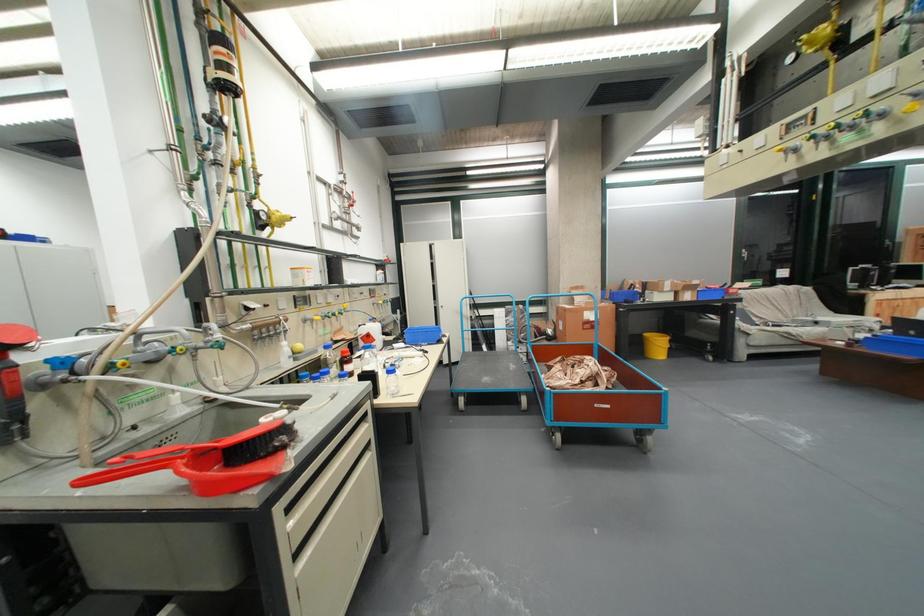
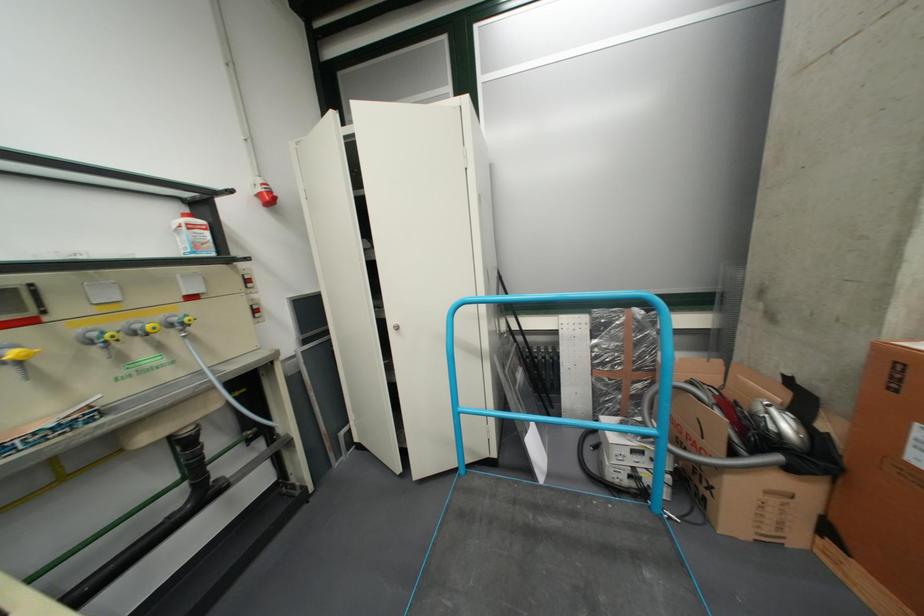
Question: In a continuous first-person perspective shot, in which direction is the camera moving?

Choices:
 (A) Left
 (B) Right
 (C) Forward
 (D) Backward

Answer: (C)